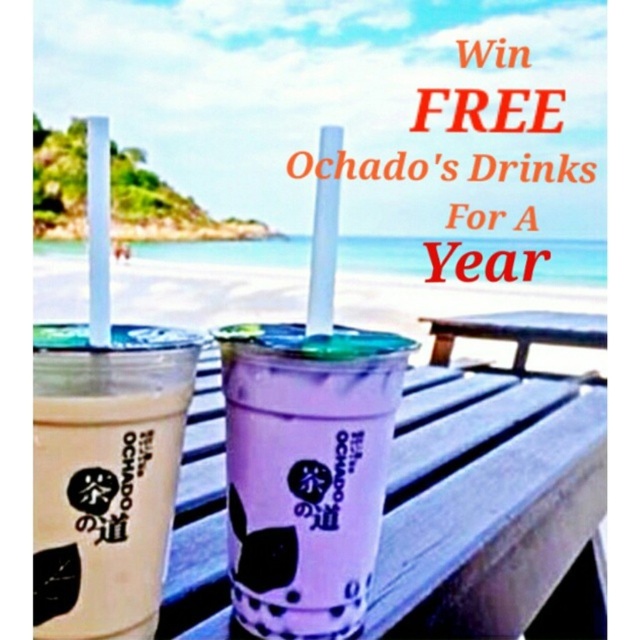
Is matte beige cup at left below wooden picnic table at center?

Yes, matte beige cup at left is below wooden picnic table at center.

This screenshot has width=640, height=640. What are the coordinates of `matte beige cup at left` in the screenshot? It's located at (106, 474).

Can you confirm if purple translucent cup at center is shorter than matte beige cup at left?

No.

Who is shorter, purple translucent cup at center or matte beige cup at left?

matte beige cup at left is shorter.

Is point (272, 560) less distant than point (113, 484)?

No, (272, 560) is behind (113, 484).

Identify the location of purple translucent cup at center. (305, 472).

Who is shorter, purple translucent cup at center or wooden picnic table at center?

With less height is wooden picnic table at center.

This screenshot has height=640, width=640. Describe the element at coordinates (305, 472) in the screenshot. I see `purple translucent cup at center` at that location.

Is point (308, 552) closer to viewer compared to point (444, 362)?

That is True.

This screenshot has width=640, height=640. In order to click on purple translucent cup at center in this screenshot , I will do `click(305, 472)`.